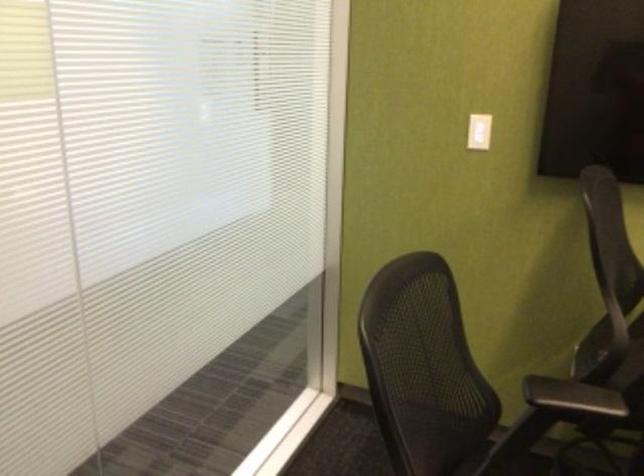
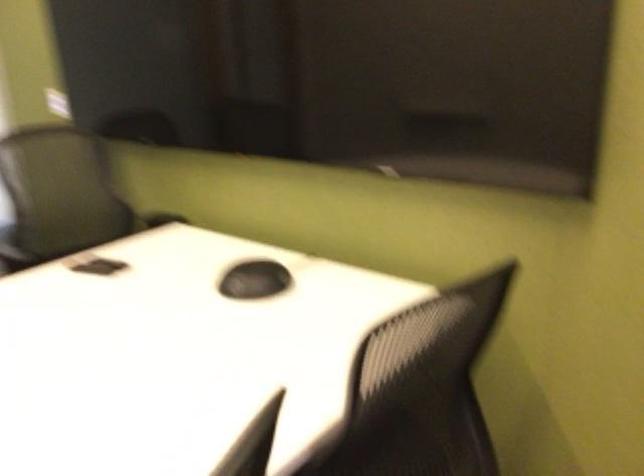
Question: In a continuous first-person perspective shot, in which direction is the camera moving?

Choices:
 (A) Left
 (B) Right
 (C) Forward
 (D) Backward

Answer: (B)